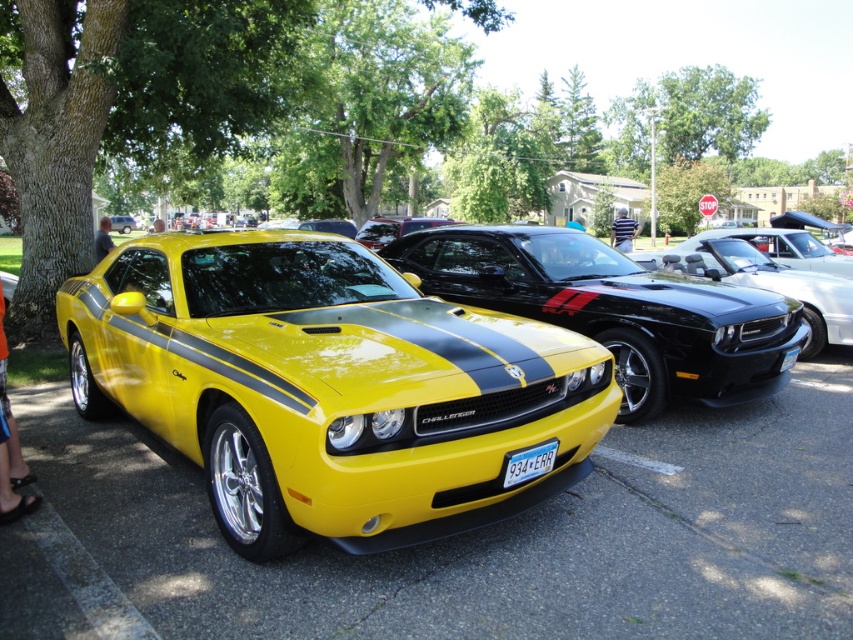
Question: Among these points, which one is nearest to the camera?

Choices:
 (A) (741, 260)
 (B) (518, 477)

Answer: (B)

Question: Can you confirm if yellow glossy dodge challenger at center is thinner than white plastic license plate at center?

Choices:
 (A) yes
 (B) no

Answer: (B)

Question: Does shiny yellow muscle car at center have a greater width compared to yellow glossy dodge challenger at center?

Choices:
 (A) yes
 (B) no

Answer: (A)

Question: Based on their relative distances, which object is nearer to the glossy black car at center?

Choices:
 (A) white plastic license plate at center
 (B) yellow glossy dodge challenger at center

Answer: (B)

Question: Can you confirm if glossy black car at center is positioned to the left of white plastic license plate at center?

Choices:
 (A) no
 (B) yes

Answer: (A)

Question: Which point is closer to the camera?

Choices:
 (A) (519, 477)
 (B) (405, 372)
 (C) (428, 264)

Answer: (B)